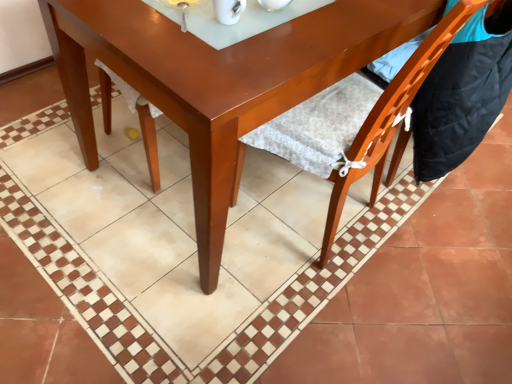
The image size is (512, 384). Find the location of `blank area beneath wooden chair at lower right, positioned as the second chair in right-to-left order (from a real-world perspective)`. blank area beneath wooden chair at lower right, positioned as the second chair in right-to-left order (from a real-world perspective) is located at coordinates (323, 229).